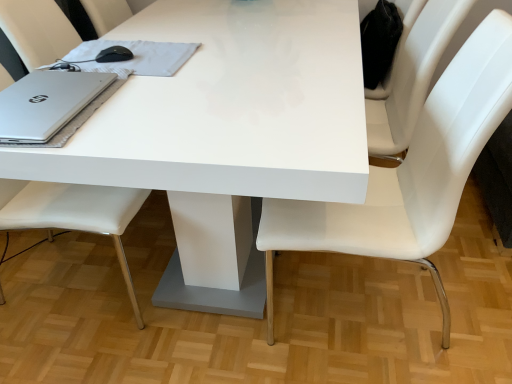
Locate an element on the screen. The image size is (512, 384). vacant space to the right of satin silver notebook at upper left is located at coordinates (228, 60).